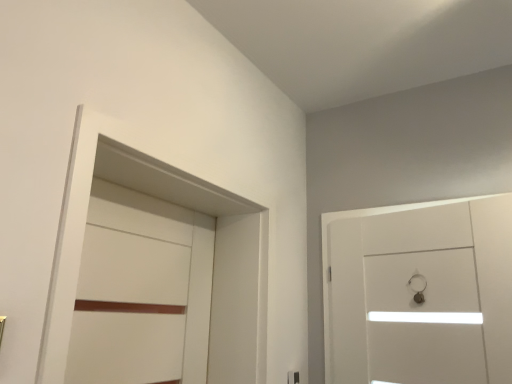
Question: Is white matte locker at left beside white glossy door at right, the 2th door in the left-to-right sequence?

Choices:
 (A) yes
 (B) no

Answer: (B)

Question: From a real-world perspective, is white matte locker at left over white glossy door at right, the 2th door in the left-to-right sequence?

Choices:
 (A) yes
 (B) no

Answer: (A)

Question: Does white matte locker at left have a lesser height compared to white glossy door at right, the first door positioned from the right?

Choices:
 (A) no
 (B) yes

Answer: (A)

Question: Is white matte locker at left taller than white glossy door at right, the first door positioned from the right?

Choices:
 (A) no
 (B) yes

Answer: (B)

Question: Is the position of white matte locker at left more distant than that of white glossy door at right, the 2th door in the left-to-right sequence?

Choices:
 (A) no
 (B) yes

Answer: (A)

Question: Is white matte door at left, which ranks as the 1th door in left-to-right order, inside the boundaries of white glossy door at right, the first door positioned from the right, or outside?

Choices:
 (A) outside
 (B) inside

Answer: (A)

Question: Looking at the image, does white matte door at left, arranged as the second door when viewed from the right, seem bigger or smaller compared to white glossy door at right, the 2th door in the left-to-right sequence?

Choices:
 (A) big
 (B) small

Answer: (B)

Question: In the image, is white matte door at left, arranged as the second door when viewed from the right, positioned in front of or behind white glossy door at right, the first door positioned from the right?

Choices:
 (A) behind
 (B) front

Answer: (B)

Question: Would you say white matte door at left, arranged as the second door when viewed from the right, is to the left or to the right of white glossy door at right, the 2th door in the left-to-right sequence, in the picture?

Choices:
 (A) left
 (B) right

Answer: (A)

Question: Is point (355, 372) positioned closer to the camera than point (172, 352)?

Choices:
 (A) closer
 (B) farther

Answer: (B)

Question: Is white glossy door at right, the first door positioned from the right, in front of or behind white matte door at left, arranged as the second door when viewed from the right, in the image?

Choices:
 (A) front
 (B) behind

Answer: (B)

Question: From a real-world perspective, is white glossy door at right, the first door positioned from the right, physically located above or below white matte door at left, arranged as the second door when viewed from the right?

Choices:
 (A) below
 (B) above

Answer: (B)

Question: In the image, is white glossy door at right, the 2th door in the left-to-right sequence, on the left side or the right side of white matte door at left, arranged as the second door when viewed from the right?

Choices:
 (A) left
 (B) right

Answer: (B)

Question: Considering the positions of white glossy door at right, the 2th door in the left-to-right sequence, and white matte locker at left in the image, is white glossy door at right, the 2th door in the left-to-right sequence, taller or shorter than white matte locker at left?

Choices:
 (A) short
 (B) tall

Answer: (A)

Question: Would you say white glossy door at right, the 2th door in the left-to-right sequence, is to the left or to the right of white matte locker at left in the picture?

Choices:
 (A) right
 (B) left

Answer: (A)